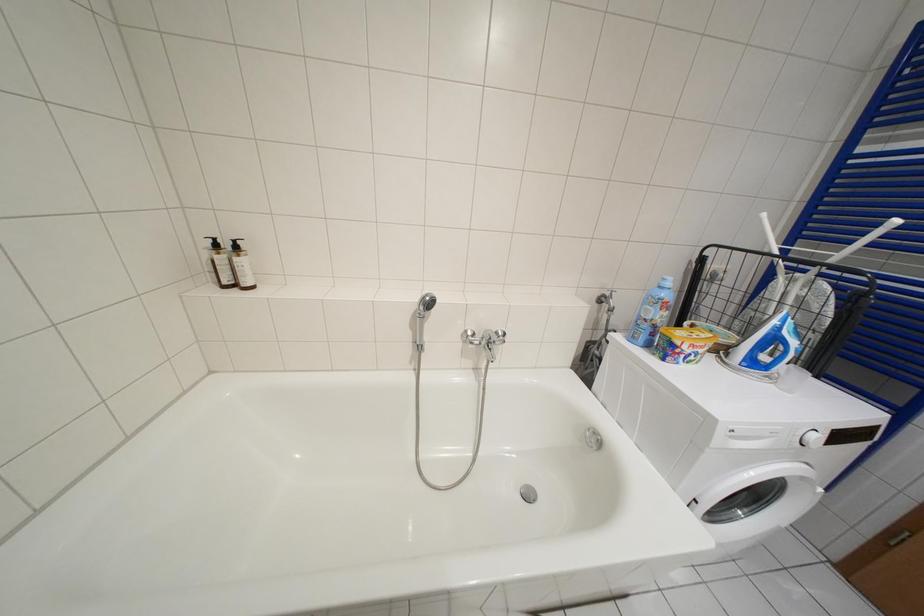
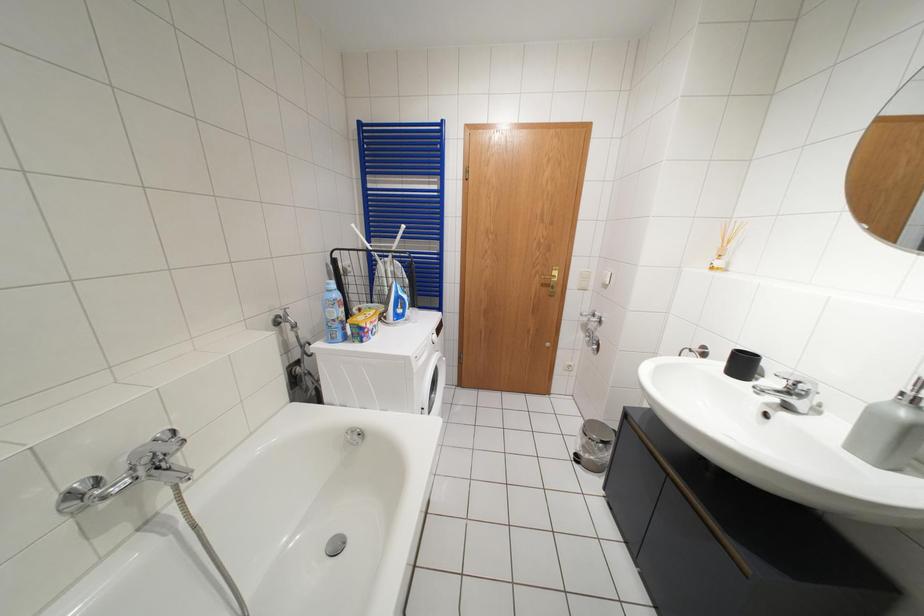
Question: The camera is either moving clockwise (left) or counter-clockwise (right) around the object. The first image is from the beginning of the video and the second image is from the end. Is the camera moving left or right when shooting the video?

Choices:
 (A) Left
 (B) Right

Answer: (A)